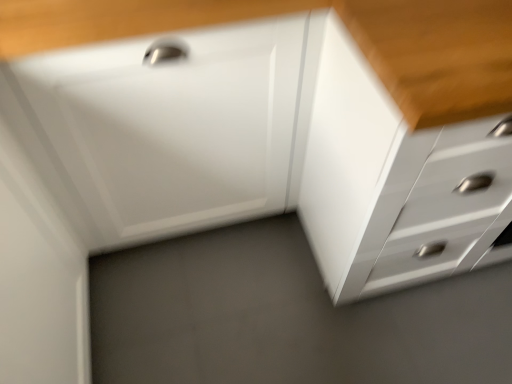
Question: Is white glossy drawer at center closer to camera compared to white glossy chest of drawers at center?

Choices:
 (A) yes
 (B) no

Answer: (B)

Question: From the image's perspective, is white glossy drawer at center located above white glossy chest of drawers at center?

Choices:
 (A) no
 (B) yes

Answer: (B)

Question: Can you confirm if white glossy drawer at center is wider than white glossy chest of drawers at center?

Choices:
 (A) no
 (B) yes

Answer: (A)

Question: Could you tell me if white glossy drawer at center is turned towards white glossy chest of drawers at center?

Choices:
 (A) yes
 (B) no

Answer: (B)

Question: Is white glossy chest of drawers at center located within white glossy drawer at center?

Choices:
 (A) yes
 (B) no

Answer: (B)

Question: Is white glossy drawer at center turned away from white glossy chest of drawers at center?

Choices:
 (A) no
 (B) yes

Answer: (A)

Question: From the image's perspective, is white glossy chest of drawers at center under white glossy drawer at center?

Choices:
 (A) no
 (B) yes

Answer: (B)

Question: Considering the relative positions of white glossy chest of drawers at center and white glossy drawer at center in the image provided, is white glossy chest of drawers at center to the left of white glossy drawer at center from the viewer's perspective?

Choices:
 (A) no
 (B) yes

Answer: (A)

Question: Can white glossy drawer at center be found inside white glossy chest of drawers at center?

Choices:
 (A) yes
 (B) no

Answer: (B)

Question: Is the depth of white glossy chest of drawers at center greater than that of white glossy drawer at center?

Choices:
 (A) no
 (B) yes

Answer: (A)

Question: Considering the relative sizes of white glossy chest of drawers at center and white glossy drawer at center in the image provided, is white glossy chest of drawers at center smaller than white glossy drawer at center?

Choices:
 (A) no
 (B) yes

Answer: (A)

Question: From a real-world perspective, is white glossy chest of drawers at center on white glossy drawer at center?

Choices:
 (A) no
 (B) yes

Answer: (B)

Question: Is white glossy chest of drawers at center bigger or smaller than white glossy drawer at center?

Choices:
 (A) big
 (B) small

Answer: (A)